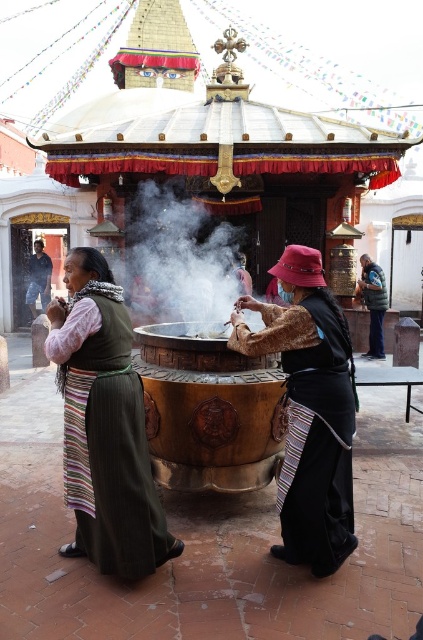
Based on the photo, you are a photographer standing at the temple entrance. You want to capture a photo of the velvet brown hat at center and dark blue jeans at lower left in the same frame. Given that your camera has a maximum focus range of 40 meters, will both subjects be in focus?

The distance between the velvet brown hat at center and dark blue jeans at lower left is 40.25 meters. Since the camera can only focus up to 40 meters, the subjects are slightly out of the focus range. The velvet brown hat at center will be in focus, but the dark blue jeans at lower left may be blurry.

You are an anthropologist observing a cultural ceremony. You notice two items of clothing in the scene. The velvet brown hat at center and the dark blue jeans at lower left. Which clothing item is bigger in size?

The velvet brown hat at center has a larger size compared to dark blue jeans at lower left.